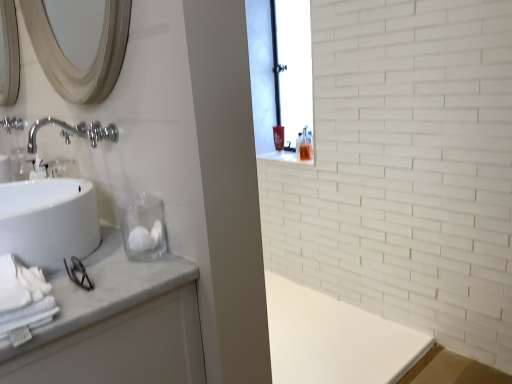
Image resolution: width=512 pixels, height=384 pixels. What do you see at coordinates (70, 63) in the screenshot?
I see `silver metallic mirror at upper left` at bounding box center [70, 63].

Describe the element at coordinates (48, 221) in the screenshot. I see `white glossy sink at left` at that location.

This screenshot has width=512, height=384. Identify the location of white glossy sink at left. (48, 221).

What do you see at coordinates (116, 325) in the screenshot?
I see `white marble bathroom cabinet at left` at bounding box center [116, 325].

Image resolution: width=512 pixels, height=384 pixels. In order to click on silver metallic mirror at upper left in this screenshot , I will do `click(70, 63)`.

Is white cotton bath towel at lower left with silver metallic mirror at upper left?

There is a gap between white cotton bath towel at lower left and silver metallic mirror at upper left.

Can you confirm if white cotton bath towel at lower left is shorter than silver metallic mirror at upper left?

Correct, white cotton bath towel at lower left is not as tall as silver metallic mirror at upper left.

Which is behind, point (20, 278) or point (50, 60)?

Positioned behind is point (50, 60).

Which is more to the right, white cotton bath towel at lower left or silver metallic mirror at upper left?

silver metallic mirror at upper left.

Where is `plumbing fixture that is the 1st one above the white glossy sink at left (from a real-world perspective)`? This screenshot has height=384, width=512. plumbing fixture that is the 1st one above the white glossy sink at left (from a real-world perspective) is located at coordinates (12, 124).

Is white glossy sink at left not within chrome metallic faucet at upper left, the second plumbing fixture in the right-to-left sequence?

white glossy sink at left is positioned outside chrome metallic faucet at upper left, the second plumbing fixture in the right-to-left sequence.

Is white glossy sink at left shorter than chrome metallic faucet at upper left, the second plumbing fixture in the right-to-left sequence?

No.

Measure the distance between white glossy sink at left and chrome metallic faucet at upper left, the second plumbing fixture positioned from the front.

white glossy sink at left and chrome metallic faucet at upper left, the second plumbing fixture positioned from the front, are 65.09 centimeters apart from each other.

This screenshot has height=384, width=512. I want to click on plumbing fixture above the chrome metallic faucet at upper left, the second plumbing fixture positioned from the front (from a real-world perspective), so click(x=102, y=133).

Is polished chrome faucet at upper left, which appears as the first plumbing fixture when viewed from the front, with chrome metallic faucet at upper left, acting as the first plumbing fixture starting from the left?

polished chrome faucet at upper left, which appears as the first plumbing fixture when viewed from the front, is not next to chrome metallic faucet at upper left, acting as the first plumbing fixture starting from the left, and they're not touching.

Can we say polished chrome faucet at upper left, placed as the second plumbing fixture when sorted from back to front, lies outside chrome metallic faucet at upper left, acting as the first plumbing fixture starting from the left?

Yes, polished chrome faucet at upper left, placed as the second plumbing fixture when sorted from back to front, is outside of chrome metallic faucet at upper left, acting as the first plumbing fixture starting from the left.

From the image's perspective, is polished chrome faucet at upper left, the 2th plumbing fixture from the left, over chrome metallic faucet at upper left, the second plumbing fixture positioned from the front?

No, from the image's perspective, polished chrome faucet at upper left, the 2th plumbing fixture from the left, is not on top of chrome metallic faucet at upper left, the second plumbing fixture positioned from the front.

From a real-world perspective, between chrome metallic faucet at upper left, which ranks as the 1th plumbing fixture in top-to-bottom order, and silver metallic mirror at upper left, who is vertically higher?

In real-world perspective, silver metallic mirror at upper left is above.

Is chrome metallic faucet at upper left, which ranks as the 1th plumbing fixture in top-to-bottom order, not near silver metallic mirror at upper left?

No.

Consider the image. Does chrome metallic faucet at upper left, placed as the 2th plumbing fixture when sorted from bottom to top, have a greater height compared to silver metallic mirror at upper left?

No, chrome metallic faucet at upper left, placed as the 2th plumbing fixture when sorted from bottom to top, is not taller than silver metallic mirror at upper left.

Is chrome metallic faucet at upper left, which ranks as the 1th plumbing fixture in top-to-bottom order, wider than silver metallic mirror at upper left?

Yes, chrome metallic faucet at upper left, which ranks as the 1th plumbing fixture in top-to-bottom order, is wider than silver metallic mirror at upper left.

Is white marble bathroom cabinet at left not within white glossy sink at left?

That's correct, white marble bathroom cabinet at left is outside of white glossy sink at left.

Which is nearer, (176, 326) or (62, 239)?

The point (62, 239) is more forward.

From the image's perspective, is white marble bathroom cabinet at left located beneath white glossy sink at left?

Yes, from the image's perspective, white marble bathroom cabinet at left is below white glossy sink at left.

From the image's perspective, which object appears higher, white glossy sink at left or white marble bathroom cabinet at left?

white glossy sink at left, from the image's perspective.

Looking at this image, considering the positions of objects white glossy sink at left and white marble bathroom cabinet at left in the image provided, who is in front, white glossy sink at left or white marble bathroom cabinet at left?

white marble bathroom cabinet at left is in front.

Looking at this image, is white glossy sink at left looking in the opposite direction of white marble bathroom cabinet at left?

That's not correct — white glossy sink at left is not looking away from white marble bathroom cabinet at left.

Is white glossy sink at left inside or outside of white marble bathroom cabinet at left?

white glossy sink at left is not inside white marble bathroom cabinet at left, it's outside.

Consider the image. From the image's perspective, is white marble bathroom cabinet at left under polished chrome faucet at upper left, placed as the second plumbing fixture when sorted from back to front?

Indeed, from the image's perspective, white marble bathroom cabinet at left is shown beneath polished chrome faucet at upper left, placed as the second plumbing fixture when sorted from back to front.

Based on the photo, is white marble bathroom cabinet at left inside the boundaries of polished chrome faucet at upper left, the 2th plumbing fixture viewed from the top, or outside?

white marble bathroom cabinet at left is located beyond the bounds of polished chrome faucet at upper left, the 2th plumbing fixture viewed from the top.

Identify the location of mirror located behind the white cotton bath towel at lower left. (70, 63).

Where is `sink to the right of chrome metallic faucet at upper left, acting as the first plumbing fixture starting from the left`? This screenshot has width=512, height=384. sink to the right of chrome metallic faucet at upper left, acting as the first plumbing fixture starting from the left is located at coordinates (48, 221).

When comparing their distances from silver metallic mirror at upper left, does polished chrome faucet at upper left, which is counted as the 1th plumbing fixture, starting from the bottom, or white glossy sink at left seem further?

Based on the image, white glossy sink at left appears to be further to silver metallic mirror at upper left.

Looking at the image, which one is located closer to polished chrome faucet at upper left, placed as the second plumbing fixture when sorted from back to front, white glossy sink at left or chrome metallic faucet at upper left, the second plumbing fixture in the right-to-left sequence?

The object closer to polished chrome faucet at upper left, placed as the second plumbing fixture when sorted from back to front, is white glossy sink at left.

Based on their spatial positions, is white cotton bath towel at lower left or chrome metallic faucet at upper left, the second plumbing fixture positioned from the front, further from white marble bathroom cabinet at left?

chrome metallic faucet at upper left, the second plumbing fixture positioned from the front.

Looking at this image, based on their spatial positions, is white glossy sink at left or chrome metallic faucet at upper left, which ranks as the 1th plumbing fixture in top-to-bottom order, closer to white marble bathroom cabinet at left?

white glossy sink at left is closer to white marble bathroom cabinet at left.

Looking at the image, which one is located closer to silver metallic mirror at upper left, white marble bathroom cabinet at left or polished chrome faucet at upper left, the 2th plumbing fixture from the left?

polished chrome faucet at upper left, the 2th plumbing fixture from the left, is closer to silver metallic mirror at upper left.

Estimate the real-world distances between objects in this image. Which object is closer to chrome metallic faucet at upper left, acting as the first plumbing fixture starting from the left, polished chrome faucet at upper left, which appears as the first plumbing fixture when viewed from the front, or white cotton bath towel at lower left?

The object closer to chrome metallic faucet at upper left, acting as the first plumbing fixture starting from the left, is polished chrome faucet at upper left, which appears as the first plumbing fixture when viewed from the front.

From the image, which object appears to be nearer to white cotton bath towel at lower left, chrome metallic faucet at upper left, placed as the 2th plumbing fixture when sorted from bottom to top, or polished chrome faucet at upper left, the 2th plumbing fixture viewed from the top?

polished chrome faucet at upper left, the 2th plumbing fixture viewed from the top, lies closer to white cotton bath towel at lower left than the other object.

From the image, which object appears to be nearer to chrome metallic faucet at upper left, the second plumbing fixture positioned from the front, white marble bathroom cabinet at left or white cotton bath towel at lower left?

Based on the image, white cotton bath towel at lower left appears to be nearer to chrome metallic faucet at upper left, the second plumbing fixture positioned from the front.

At what (x,y) coordinates should I click in order to perform the action: click on sink between silver metallic mirror at upper left and white marble bathroom cabinet at left from top to bottom. Please return your answer as a coordinate pair (x, y). Image resolution: width=512 pixels, height=384 pixels. Looking at the image, I should click on (48, 221).

Identify the location of plumbing fixture between white glossy sink at left and chrome metallic faucet at upper left, the second plumbing fixture positioned from the front, along the z-axis. (102, 133).

Image resolution: width=512 pixels, height=384 pixels. Find the location of `sink between silver metallic mirror at upper left and white cotton bath towel at lower left in the up-down direction`. sink between silver metallic mirror at upper left and white cotton bath towel at lower left in the up-down direction is located at coordinates (48, 221).

Identify the location of sink between white cotton bath towel at lower left and chrome metallic faucet at upper left, acting as the first plumbing fixture starting from the left, in the front-back direction. The height and width of the screenshot is (384, 512). (48, 221).